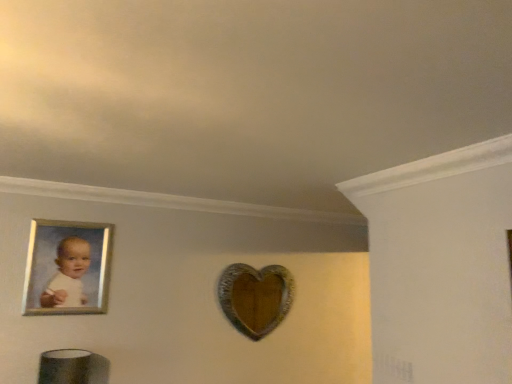
Question: Considering the relative positions of wooden heart at center and silver metallic picture frame at upper left in the image provided, is wooden heart at center to the left or to the right of silver metallic picture frame at upper left?

Choices:
 (A) left
 (B) right

Answer: (B)

Question: Does point (275, 299) appear closer or farther from the camera than point (42, 284)?

Choices:
 (A) closer
 (B) farther

Answer: (B)

Question: Relative to silver metallic picture frame at upper left, is wooden heart at center in front or behind?

Choices:
 (A) behind
 (B) front

Answer: (A)

Question: Is point (45, 297) closer or farther from the camera than point (225, 279)?

Choices:
 (A) farther
 (B) closer

Answer: (B)

Question: From the image's perspective, is silver metallic picture frame at upper left positioned above or below wooden heart at center?

Choices:
 (A) above
 (B) below

Answer: (A)

Question: Is silver metallic picture frame at upper left inside or outside of wooden heart at center?

Choices:
 (A) outside
 (B) inside

Answer: (A)

Question: Looking at the image, does silver metallic picture frame at upper left seem bigger or smaller compared to wooden heart at center?

Choices:
 (A) big
 (B) small

Answer: (B)